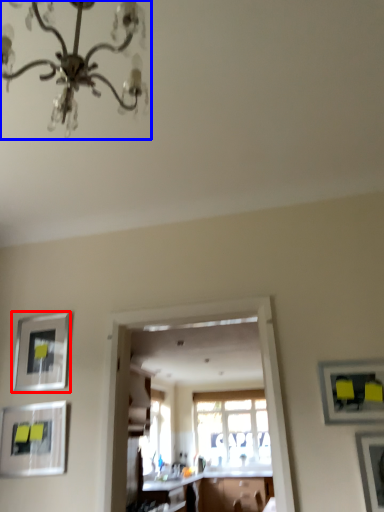
Question: Which point is closer to the camera, picture frame (highlighted by a red box) or chandelier (highlighted by a blue box)?

Choices:
 (A) picture frame
 (B) chandelier

Answer: (B)